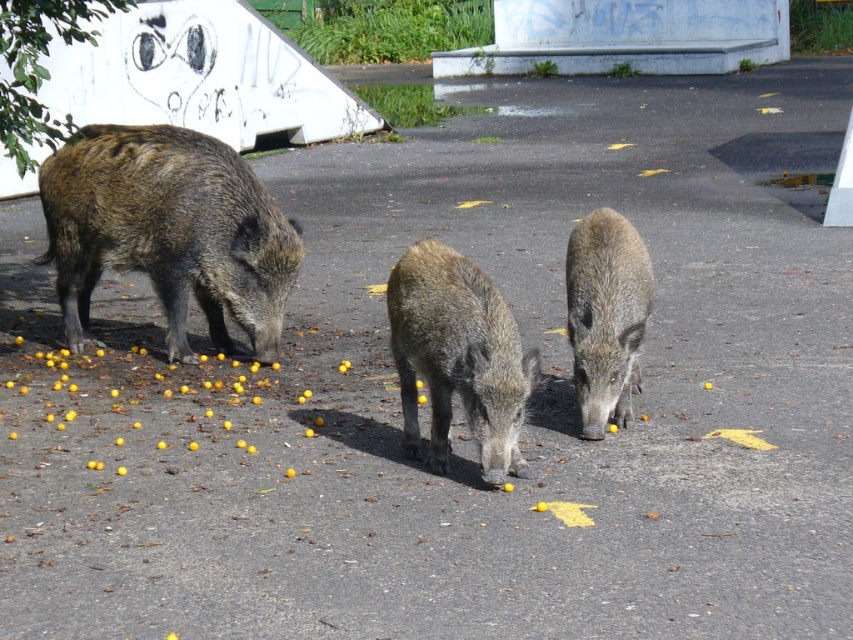
Who is positioned more to the left, brown textured pig at left or brown rough skin pig at center?

From the viewer's perspective, brown textured pig at left appears more on the left side.

Is the position of brown textured pig at left more distant than that of brown rough skin pig at center?

Yes, brown textured pig at left is behind brown rough skin pig at center.

Who is more forward, (260, 241) or (448, 458)?

Point (448, 458) is more forward.

The image size is (853, 640). In order to click on brown textured pig at left in this screenshot , I will do `click(167, 230)`.

Can you confirm if brown textured pig at left is taller than brown rough textured pig at center?

Correct, brown textured pig at left is much taller as brown rough textured pig at center.

Which is in front, point (294, 234) or point (619, 413)?

Point (619, 413) is more forward.

Identify the location of brown textured pig at left. The image size is (853, 640). (167, 230).

Between point (431, 440) and point (631, 225), which one is positioned behind?

The point (631, 225) is behind.

Can you confirm if brown rough skin pig at center is positioned to the left of brown rough textured pig at center?

Correct, you'll find brown rough skin pig at center to the left of brown rough textured pig at center.

Is point (427, 356) farther from viewer compared to point (618, 236)?

No.

In order to click on brown rough skin pig at center in this screenshot , I will do pyautogui.click(x=457, y=356).